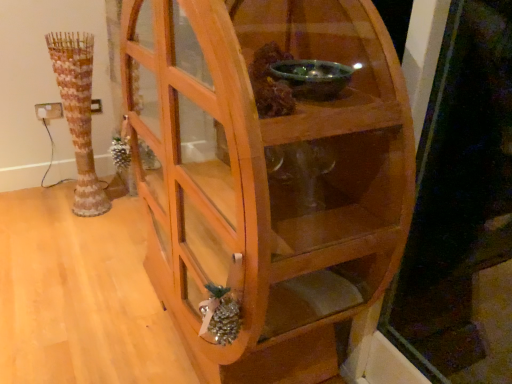
Where is `vacant region in front of wooden textured vase at left`? This screenshot has width=512, height=384. vacant region in front of wooden textured vase at left is located at coordinates (81, 231).